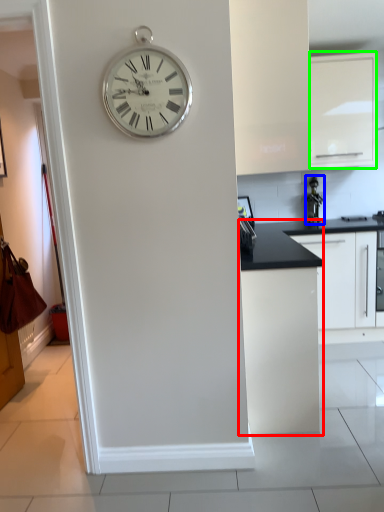
Question: Which object is positioned closest to cabinetry (highlighted by a red box)? Select from appliance (highlighted by a blue box) and cabinetry (highlighted by a green box).

Choices:
 (A) appliance
 (B) cabinetry

Answer: (A)